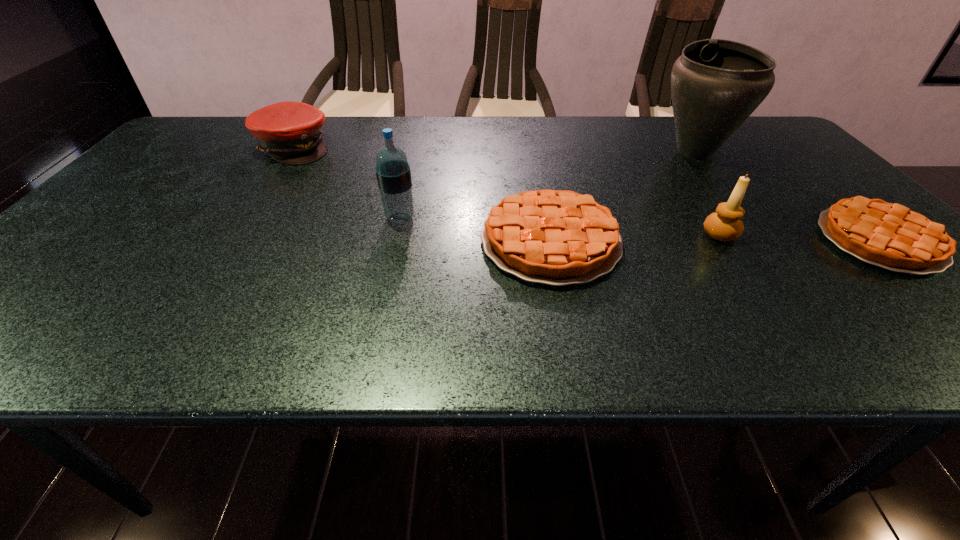
Please point a spot on the left to add another pie. Please provide its 2D coordinates. Your answer should be formatted as a tuple, i.e. [(x, y)], where the tuple contains the x and y coordinates of a point satisfying the conditions above.

[(220, 242)]